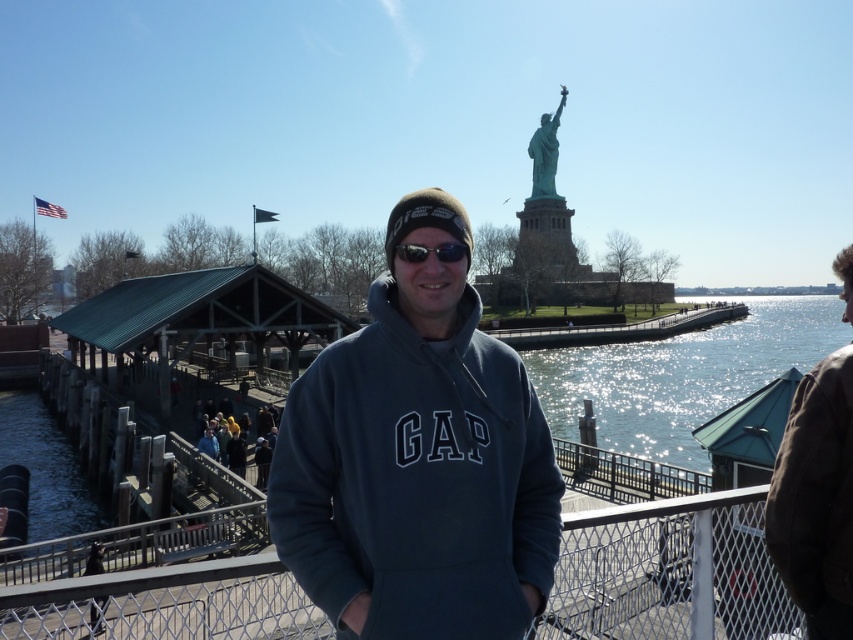
You are a photographer trying to capture the reflection of the Statue of Liberty in the water. You have the shiny reflective water at lower center and sunglasses at center in your viewfinder. Which object in your viewfinder is bigger and would better show the reflection?

The shiny reflective water at lower center is larger in size than sunglasses at center, so it would better show the reflection of the Statue of Liberty.